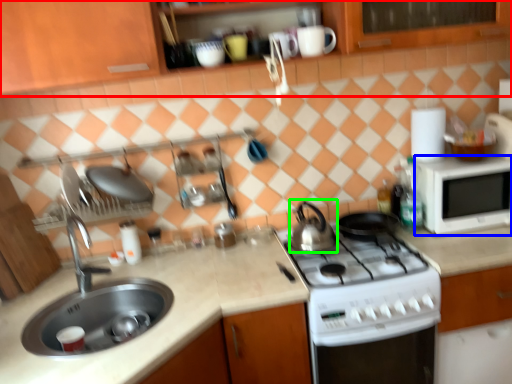
Question: Which object is the closest to the cabinetry (highlighted by a red box)? Choose among these: microwave oven (highlighted by a blue box) or tea pot (highlighted by a green box).

Choices:
 (A) microwave oven
 (B) tea pot

Answer: (A)